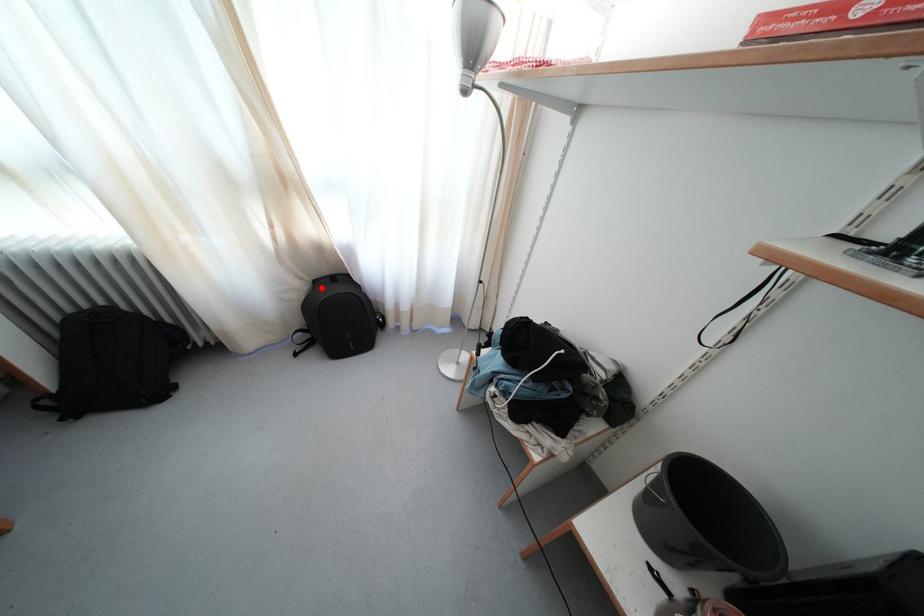
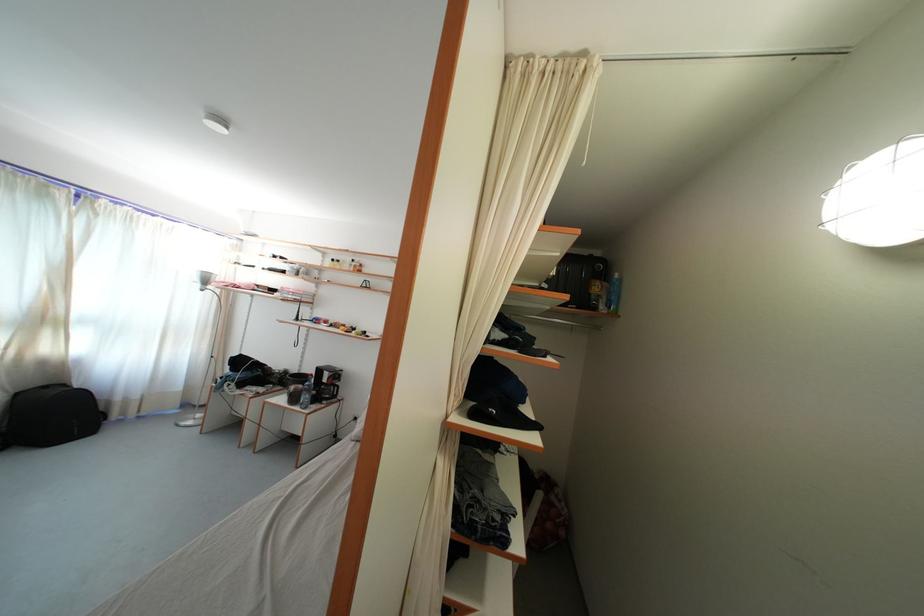
In the second image, find the point that corresponds to the highlighted location in the first image.

(23, 400)